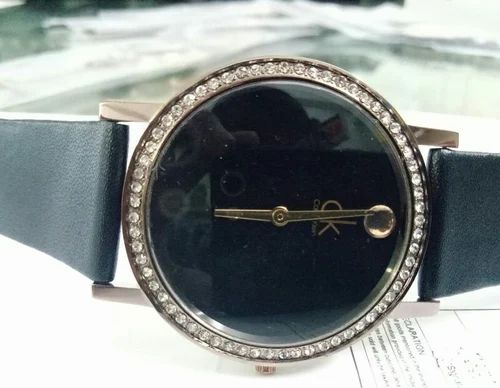
You are a GUI agent. You are given a task and a screenshot of the screen. Output one action in this format:
    pyautogui.click(x=<x>, y=<y>)
    Task: Click on the reflection in clock face
    The image size is (500, 388).
    Given the screenshot: What is the action you would take?
    pyautogui.click(x=280, y=124)